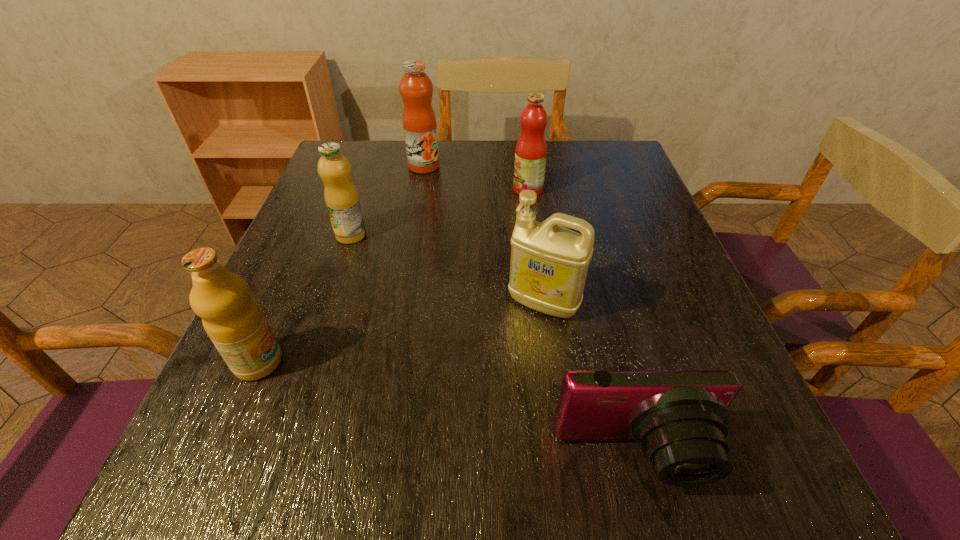
The image size is (960, 540). In order to click on the nearest object in this screenshot , I will do `click(680, 417)`.

Locate an element on the screen. The width and height of the screenshot is (960, 540). free region located 0.250m on the front label of the third fruit juice from left to right is located at coordinates (412, 234).

Locate an element on the screen. The image size is (960, 540). free space located on the front label of the second farthest object is located at coordinates (361, 190).

What are the coordinates of `free space located on the front label of the second farthest object` in the screenshot? It's located at (457, 190).

What are the coordinates of `blank space located on the front label of the second farthest object` in the screenshot? It's located at (473, 190).

You are a GUI agent. You are given a task and a screenshot of the screen. Output one action in this format:
    pyautogui.click(x=<x>, y=<y>)
    Task: Click on the free space located 0.400m on the front label of the fifth farthest object
    
    Given the screenshot: What is the action you would take?
    pyautogui.click(x=523, y=362)

This screenshot has height=540, width=960. I want to click on vacant area situated 0.160m on the left of the detergent, so click(422, 303).

The height and width of the screenshot is (540, 960). Identify the location of free space located 0.110m on the front label of the second nearest fruit juice. point(336,281).

Find the location of `object that is positioned at the near edge`. object that is positioned at the near edge is located at coordinates (680, 417).

At what (x,y) coordinates should I click in order to perform the action: click on object located in the right edge section of the desktop. Please return your answer as a coordinate pair (x, y). This screenshot has width=960, height=540. Looking at the image, I should click on (680, 417).